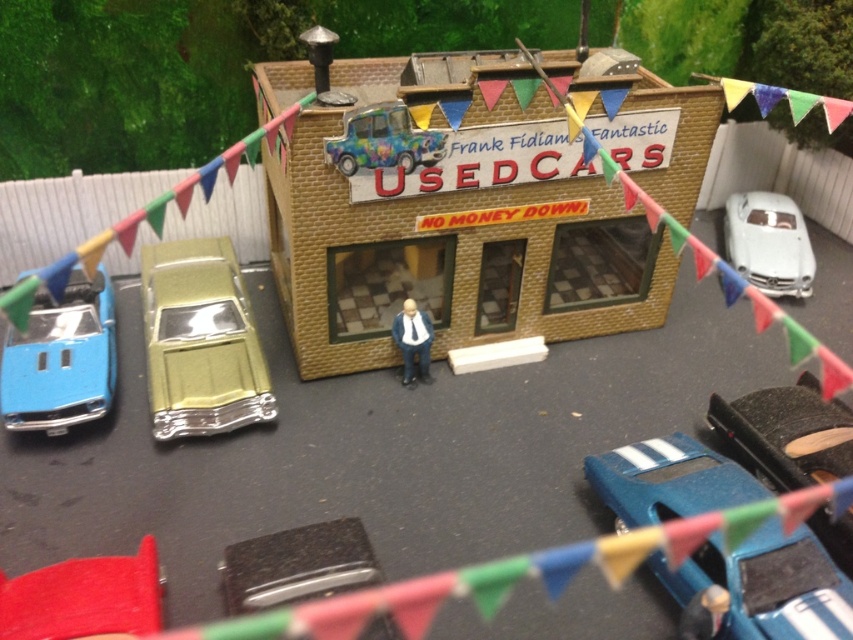
Does brick building at center have a smaller size compared to matte blue car at left?

Incorrect, brick building at center is not smaller in size than matte blue car at left.

Measure the distance between brick building at center and camera.

The distance of brick building at center from camera is 2.98 meters.

Between point (630, 316) and point (62, 406), which one is positioned behind?

Point (630, 316)

Find the location of a particular element. brick building at center is located at coordinates (451, 221).

Is point (49, 413) farther from camera compared to point (386, 136)?

Yes, point (49, 413) is behind point (386, 136).

Does matte blue car at left have a larger size compared to psychedelic paint car at center?

Yes.

Locate an element on the screen. This screenshot has height=640, width=853. matte blue car at left is located at coordinates (61, 358).

Find the location of a particular element. The image size is (853, 640). matte blue car at left is located at coordinates (61, 358).

Is brick building at center to the right of metallic gold car at left from the viewer's perspective?

Correct, you'll find brick building at center to the right of metallic gold car at left.

Who is higher up, brick building at center or metallic gold car at left?

brick building at center is above.

Describe the element at coordinates (451, 221) in the screenshot. I see `brick building at center` at that location.

Identify the location of brick building at center. (451, 221).